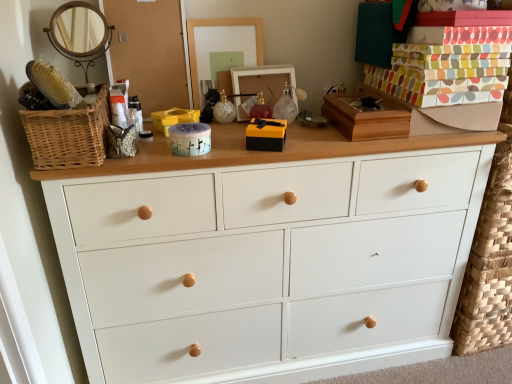
The width and height of the screenshot is (512, 384). What are the coordinates of `spots to the right of yellow matte/black textured box at center, which ranks as the second box in right-to-left order` in the screenshot? It's located at (315, 146).